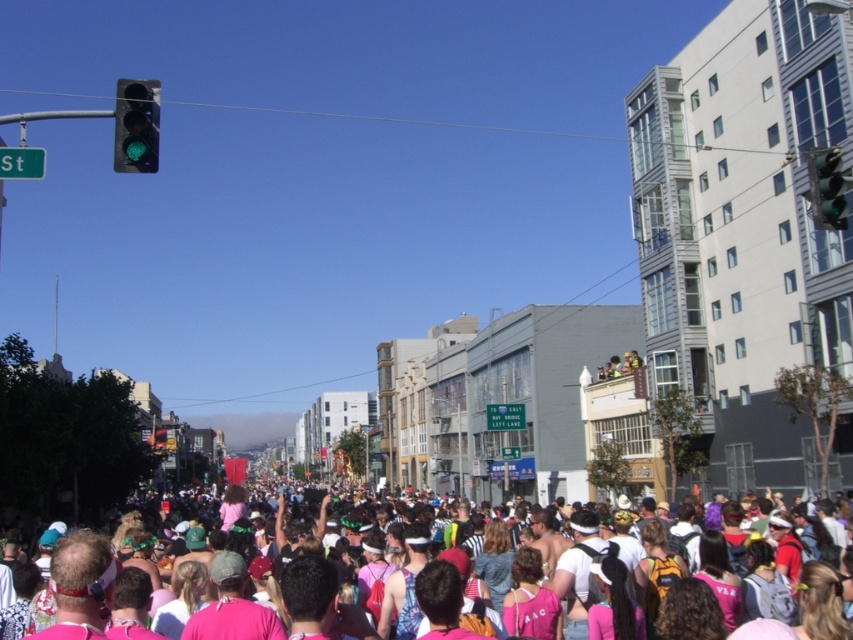
You are standing in the middle of the street during the parade and see the point at coordinates (136, 125). What object is located at that point?

The green glass traffic light at upper left is located at point (136, 125).